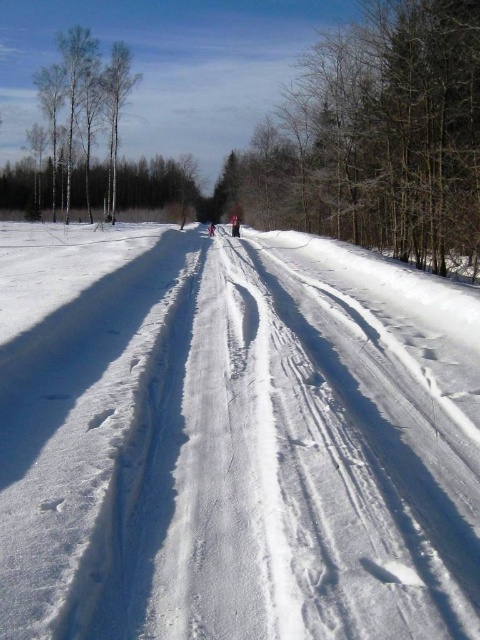
Is point (45, 70) closer to viewer compared to point (239, 230)?

No, (45, 70) is further to viewer.

Between point (126, 51) and point (238, 234), which one is positioned behind?

The point (126, 51) is more distant.

Image resolution: width=480 pixels, height=640 pixels. I want to click on white bark trees at left, so click(87, 100).